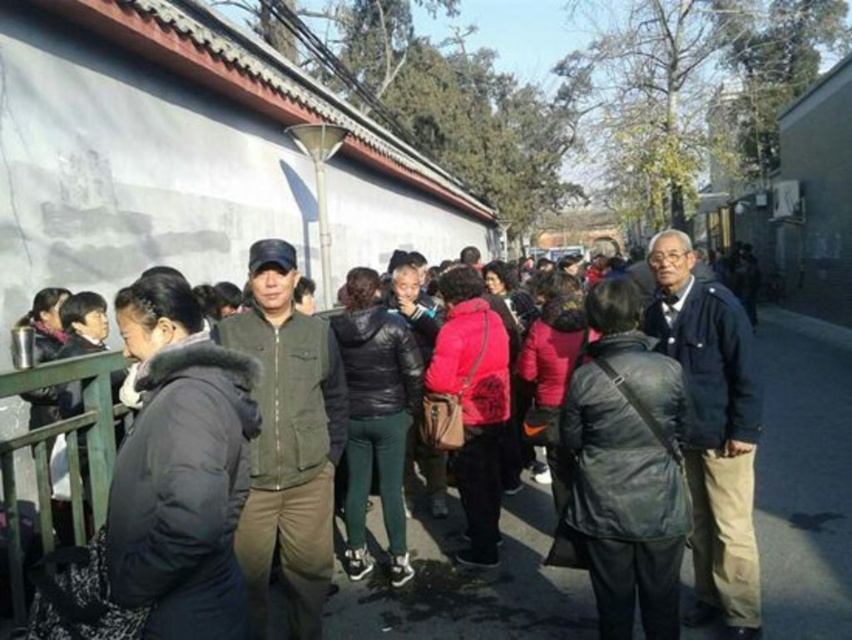
Question: Is dark gray jacket at center to the right of dark green jacket at center from the viewer's perspective?

Choices:
 (A) no
 (B) yes

Answer: (B)

Question: Which object appears farthest from the camera in this image?

Choices:
 (A) dark green jacket at center
 (B) dark gray jacket at center

Answer: (B)

Question: Is dark gray jacket at center thinner than dark green jacket at center?

Choices:
 (A) no
 (B) yes

Answer: (A)

Question: Which point is farther to the camera?

Choices:
 (A) dark green jacket at center
 (B) dark gray jacket at center

Answer: (B)

Question: Among these objects, which one is farthest from the camera?

Choices:
 (A) dark green jacket at center
 (B) dark gray jacket at center

Answer: (B)

Question: Observing the image, what is the correct spatial positioning of dark gray jacket at center in reference to dark green jacket at center?

Choices:
 (A) left
 (B) right

Answer: (B)